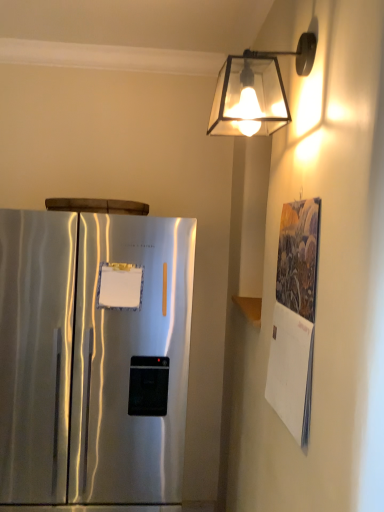
Question: In terms of size, does textured paper calendar at right appear bigger or smaller than satin silver refrigerator at left?

Choices:
 (A) small
 (B) big

Answer: (A)

Question: Is textured paper calendar at right taller or shorter than satin silver refrigerator at left?

Choices:
 (A) tall
 (B) short

Answer: (B)

Question: Which object is the farthest from the satin silver refrigerator at left?

Choices:
 (A) translucent glass lampshade at upper right
 (B) textured paper calendar at right

Answer: (A)

Question: Based on their relative distances, which object is farther from the translucent glass lampshade at upper right?

Choices:
 (A) textured paper calendar at right
 (B) satin silver refrigerator at left

Answer: (B)